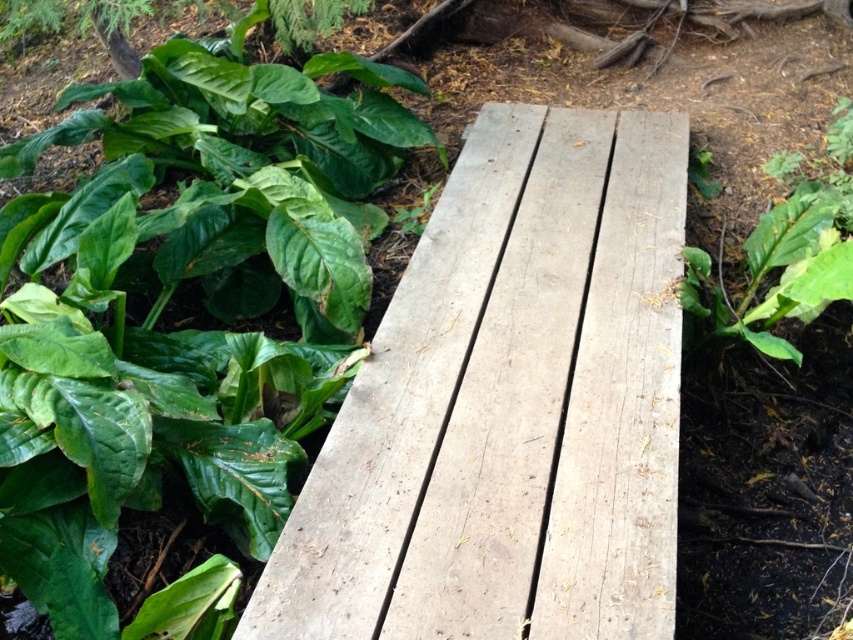
Based on the photo, you are a gardener who wants to place a small statue between the green matte leafy plant at upper left and the green leafy plant at right. Which plant should the statue be closer to if you want it to be near the smaller one?

The statue should be closer to the green leafy plant at right because it is smaller than the green matte leafy plant at upper left.

You are standing at the origin point in the image. Where is the weathered wood bench at center located in terms of coordinates?

The weathered wood bench at center is located at coordinates point (509, 404).